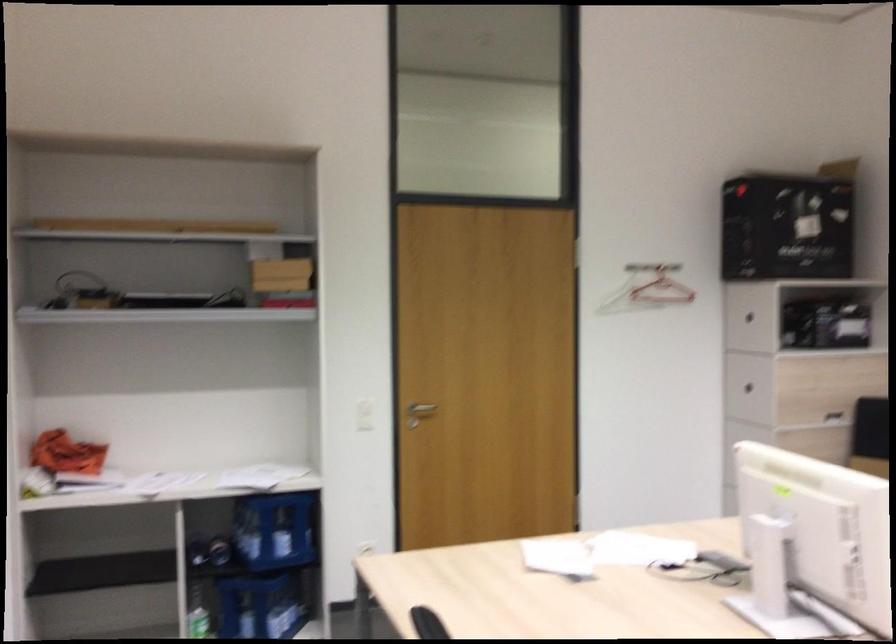
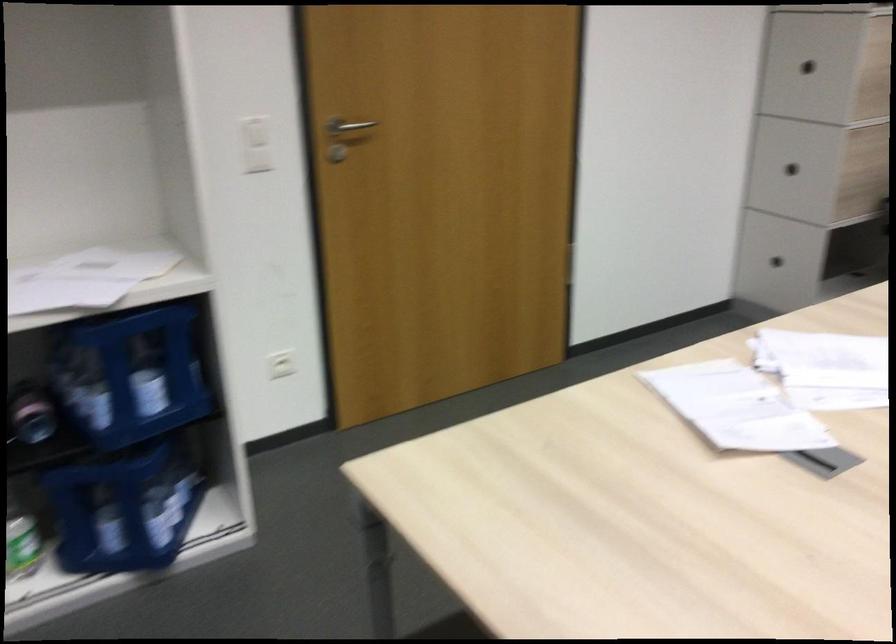
Question: In a continuous first-person perspective shot, in which direction is the camera moving?

Choices:
 (A) Left
 (B) Right
 (C) Forward
 (D) Backward

Answer: (C)